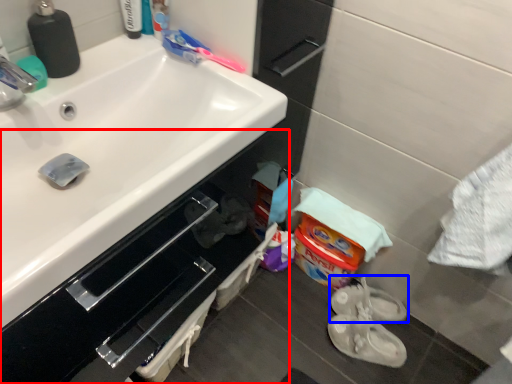
Question: Among these objects, which one is nearest to the camera, bathroom cabinet (highlighted by a red box) or footwear (highlighted by a blue box)?

Choices:
 (A) bathroom cabinet
 (B) footwear

Answer: (A)